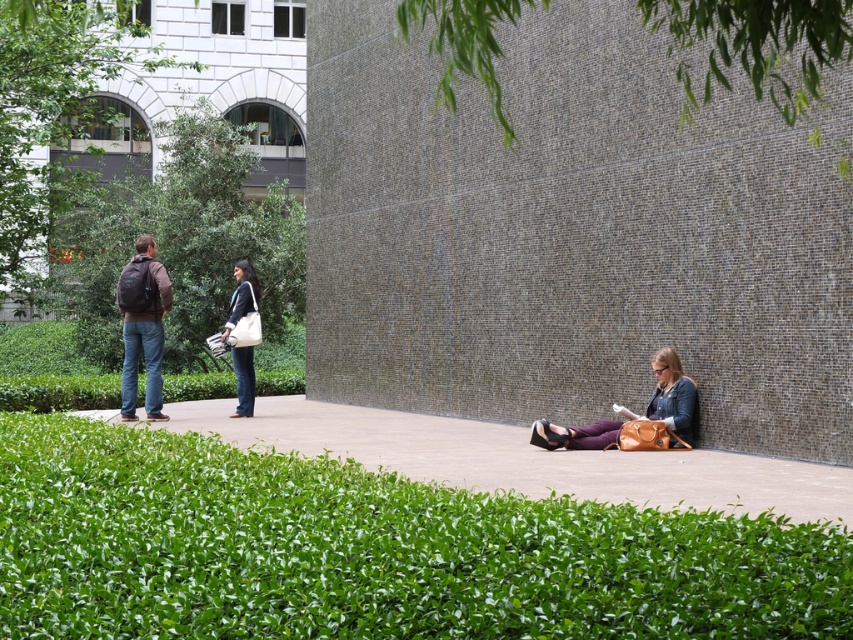
Can you confirm if green leafy grass at lower center is positioned to the left of green leafy hedge at upper left?

Incorrect, green leafy grass at lower center is not on the left side of green leafy hedge at upper left.

Between point (799, 566) and point (190, 284), which one is positioned behind?

Point (190, 284)

Find the location of `green leafy grass at lower center`. green leafy grass at lower center is located at coordinates (370, 552).

Is point (190, 129) in front of point (149, 257)?

No.

Does green leafy hedge at upper left appear on the right side of matte black backpack at left?

No, green leafy hedge at upper left is not to the right of matte black backpack at left.

Where is `green leafy hedge at upper left`? The width and height of the screenshot is (853, 640). green leafy hedge at upper left is located at coordinates (181, 241).

In the scene shown: Is leather brown purse at lower right positioned at the back of white canvas tote bag at center?

No, leather brown purse at lower right is in front of white canvas tote bag at center.

How distant is leather brown purse at lower right from white canvas tote bag at center?

They are 5.98 meters apart.

The height and width of the screenshot is (640, 853). What do you see at coordinates (669, 396) in the screenshot? I see `leather brown purse at lower right` at bounding box center [669, 396].

Image resolution: width=853 pixels, height=640 pixels. Identify the location of leather brown purse at lower right. (669, 396).